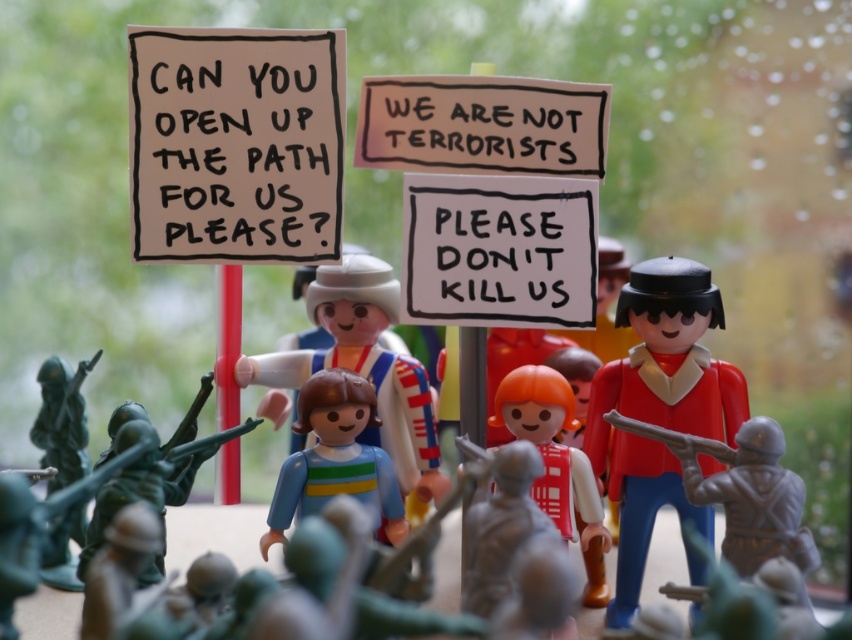
Question: Which point is closer to the camera?

Choices:
 (A) white paper sign at upper left
 (B) matte plastic figure at center
 (C) orange matte/soft toy at center

Answer: (B)

Question: Which is farther from the white paper sign at upper left?

Choices:
 (A) white plastic toy at center
 (B) white paper sign at center

Answer: (A)

Question: Is white paper sign at center positioned at the back of brown cardboard sign at center?

Choices:
 (A) yes
 (B) no

Answer: (B)

Question: Based on their relative distances, which object is nearer to the green plastic toy soldier at lower left?

Choices:
 (A) matte plastic figure at center
 (B) red plastic figure at center
 (C) white paper sign at upper left

Answer: (A)

Question: Considering the relative positions of red plastic figure at center and orange matte/soft toy at center in the image provided, where is red plastic figure at center located with respect to orange matte/soft toy at center?

Choices:
 (A) below
 (B) above

Answer: (B)

Question: In this image, where is matte plastic figure at center located relative to green plastic toy soldier at lower left?

Choices:
 (A) right
 (B) left

Answer: (A)